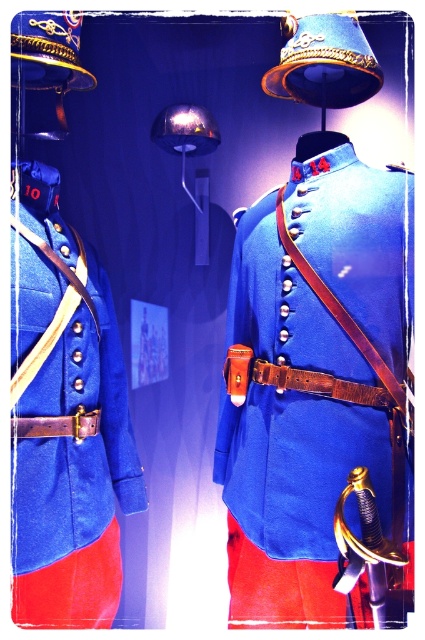
Is point (291, 234) more distant than point (351, 476)?

Yes, point (291, 234) is farther from viewer.

Does blue woolen coat at center have a lesser height compared to gold polished metal sword at center?

No, blue woolen coat at center is not shorter than gold polished metal sword at center.

Between point (306, 483) and point (371, 592), which one is positioned behind?

Point (306, 483)

Locate an element on the screen. This screenshot has width=425, height=640. blue woolen coat at center is located at coordinates (314, 380).

Is matte blue fabric jacket at left to the right of gold polished metal sword at center from the viewer's perspective?

Incorrect, matte blue fabric jacket at left is not on the right side of gold polished metal sword at center.

Where is `matte blue fabric jacket at left`? This screenshot has height=640, width=425. matte blue fabric jacket at left is located at coordinates (65, 419).

At what (x,y) coordinates should I click in order to perform the action: click on matte blue fabric jacket at left. Please return your answer as a coordinate pair (x, y). Looking at the image, I should click on (65, 419).

Is blue woolen coat at center to the left of matte blue fabric jacket at left from the viewer's perspective?

No, blue woolen coat at center is not to the left of matte blue fabric jacket at left.

Is blue woolen coat at center closer to the viewer compared to matte blue fabric jacket at left?

Yes, blue woolen coat at center is closer to the viewer.

The width and height of the screenshot is (425, 640). What do you see at coordinates (314, 380) in the screenshot?
I see `blue woolen coat at center` at bounding box center [314, 380].

The width and height of the screenshot is (425, 640). What are the coordinates of `blue woolen coat at center` in the screenshot? It's located at [314, 380].